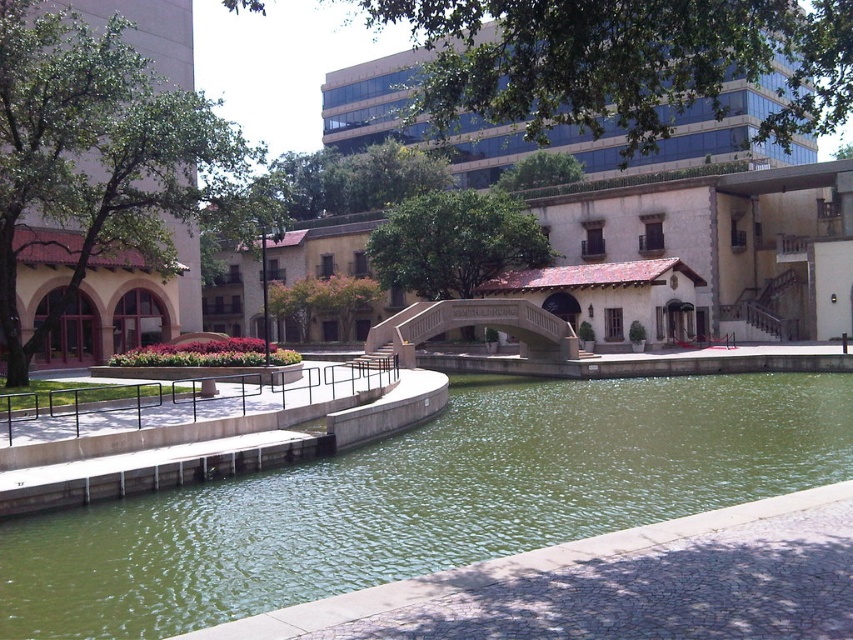
Who is more distant from viewer, [294,520] or [410,340]?

Positioned behind is point [410,340].

Measure the distance between point (430, 561) and camera.

They are 10.98 meters apart.

You are a GUI agent. You are given a task and a screenshot of the screen. Output one action in this format:
    pyautogui.click(x=<x>, y=<y>)
    Task: Click on the green concrete river at center
    This screenshot has width=853, height=640.
    Given the screenshot: What is the action you would take?
    pyautogui.click(x=448, y=493)